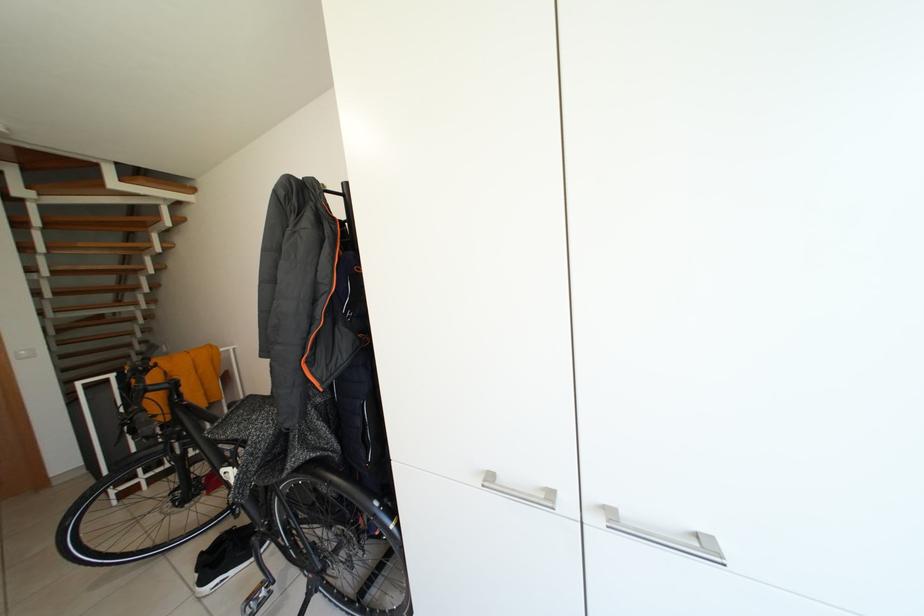
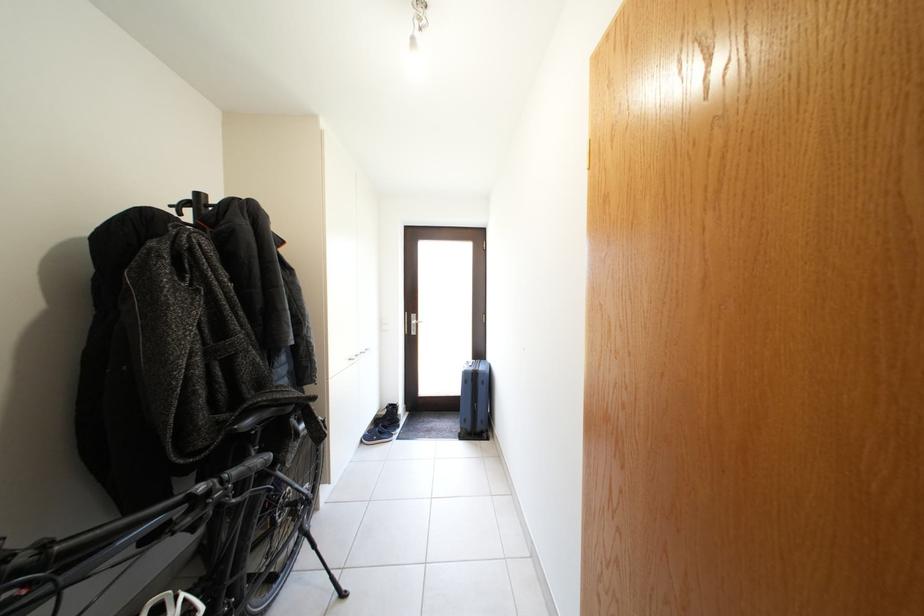
Question: I am providing you with two images of the same scene from different viewpoints. After the viewpoint changes to image2, which objects are now occluded?

Choices:
 (A) silver cabinet handle
 (B) blue suitcase
 (C) silver electronic device
 (D) silver door handle

Answer: (A)